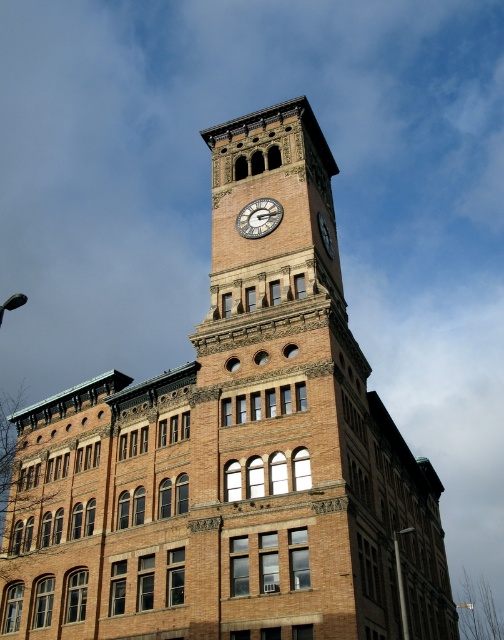
You are standing in front of a historic brick building with a clock tower. You notice two clocks on the building. The first is a brass clock face at center, and the second is a dark brown stone clock at upper center. Which clock is closer to you?

The brass clock face at center is closer to you because it is in front of the dark brown stone clock at upper center.

You are standing in front of the historic brick building and want to determine the relative positions of two points marked on the clock tower. The first point is at coordinates point (x=272, y=225) and the second is at point (x=319, y=227). Which point is closer to you?

Point (x=272, y=225) is closer to the viewer than point (x=319, y=227).